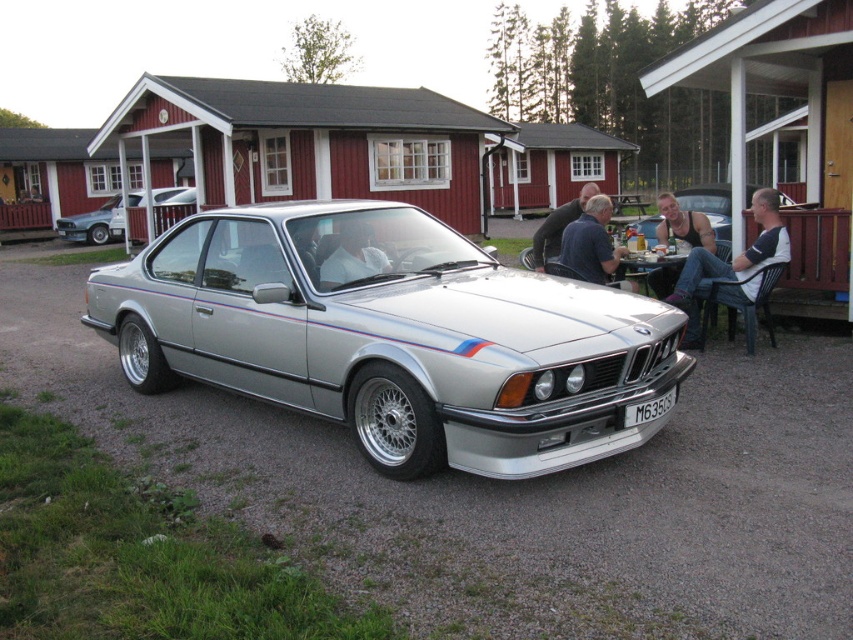
You are at the scene of the image and want to find the dark blue shirt at upper center. Where should you look to locate it?

The dark blue shirt at upper center is located at point coordinates 0.380 on the x axis and 0.694 on the y axis.

You are at a casual outdoor gathering and see the silver BMW sports car parked nearby. You notice the matte black tank top at right and the black plastic license plate at center. Which object is positioned higher relative to the other?

The matte black tank top at right is located above the black plastic license plate at center, so it is positioned higher.